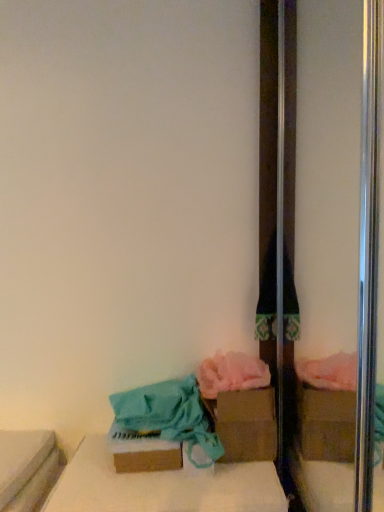
Question: In the image, is brown cardboard box at lower center positioned in front of or behind teal fabric bag at lower left, the first material in the left-to-right sequence?

Choices:
 (A) front
 (B) behind

Answer: (A)

Question: Visually, is brown cardboard box at lower center positioned to the left or to the right of teal fabric bag at lower left, the first material in the left-to-right sequence?

Choices:
 (A) left
 (B) right

Answer: (B)

Question: Estimate the real-world distances between objects in this image. Which object is closer to the teal fabric bag at lower left, the first material in the left-to-right sequence?

Choices:
 (A) brown cardboard box at center, the first cardboard box from the right
 (B) brown cardboard box at lower center
 (C) brown cardboard box at lower center, the second cardboard box from the back
 (D) pink fluffy towel at lower center, which is the 2th material from left to right

Answer: (C)

Question: Which of these objects is positioned closest to the brown cardboard box at center, the second cardboard box from the front?

Choices:
 (A) teal fabric bag at lower left, the 2th material in the right-to-left sequence
 (B) brown cardboard box at lower center, the second cardboard box from the back
 (C) pink fluffy towel at lower center, which is the 2th material from left to right
 (D) brown cardboard box at lower center

Answer: (C)